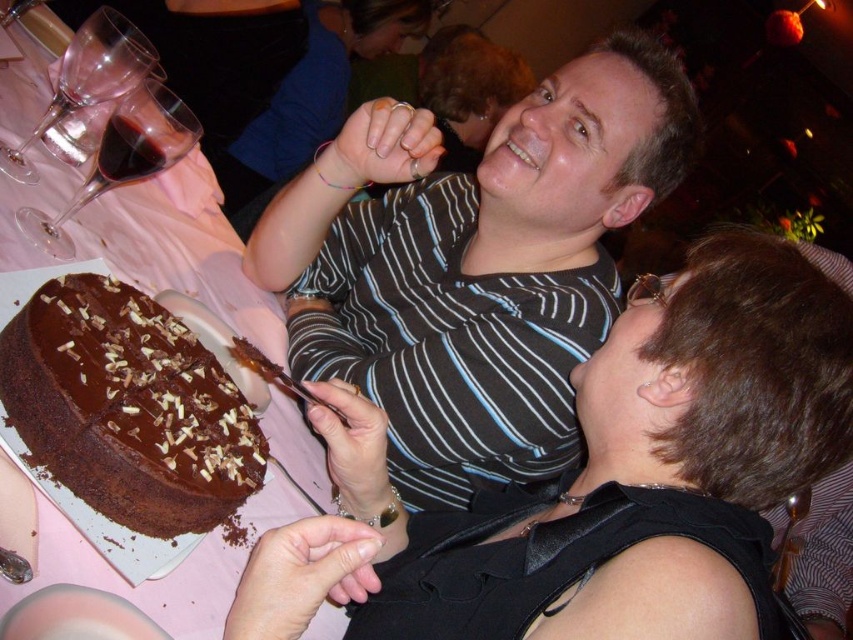
Question: Can you confirm if black fabric at center is positioned to the left of striped shirt at upper center?

Choices:
 (A) no
 (B) yes

Answer: (A)

Question: Which of the following is the farthest from the observer?

Choices:
 (A) (338, 305)
 (B) (396, 563)
 (C) (196, 440)

Answer: (A)

Question: Can you confirm if striped shirt at upper center is positioned above chocolatesmoothcake at left?

Choices:
 (A) yes
 (B) no

Answer: (A)

Question: Does black fabric at center come behind chocolate cake at left?

Choices:
 (A) no
 (B) yes

Answer: (A)

Question: Among these points, which one is nearest to the camera?

Choices:
 (A) (222, 460)
 (B) (190, 244)
 (C) (602, 141)

Answer: (A)

Question: Estimate the real-world distances between objects in this image. Which object is farther from the chocolate cake at left?

Choices:
 (A) chocolatesmoothcake at left
 (B) black fabric at center

Answer: (B)